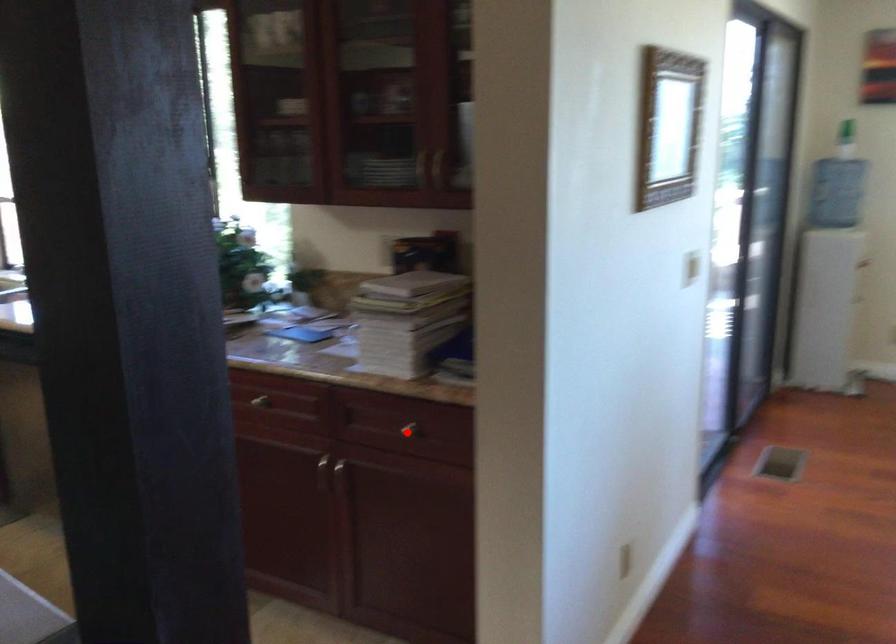
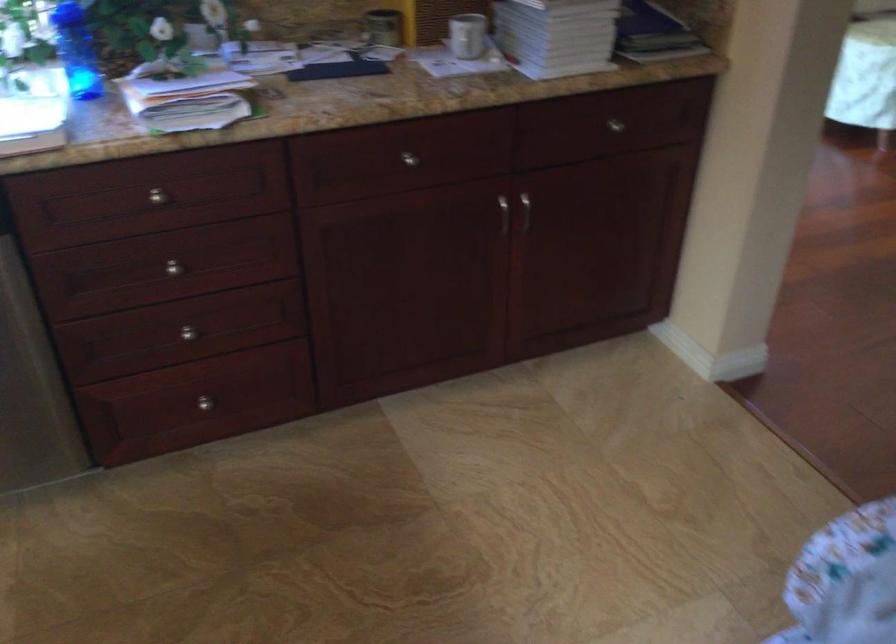
The point at the highlighted location is marked in the first image. Where is the corresponding point in the second image?

(615, 125)